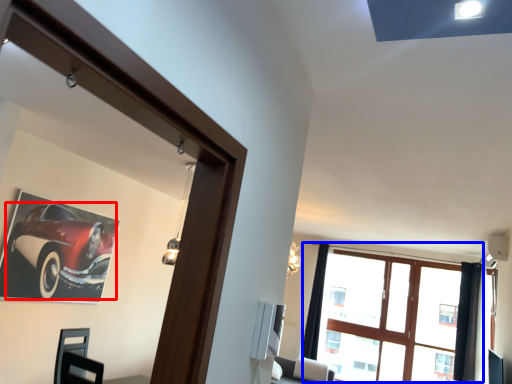
Question: Among these objects, which one is nearest to the camera, car (highlighted by a red box) or window (highlighted by a blue box)?

Choices:
 (A) car
 (B) window

Answer: (A)